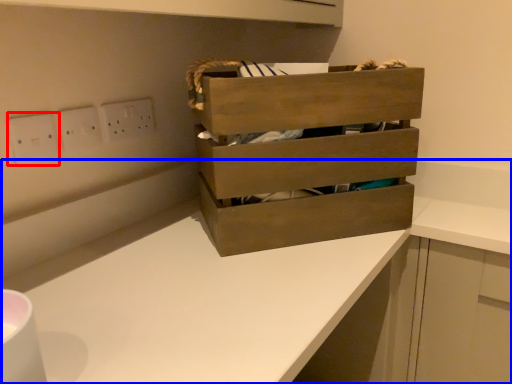
Question: Which of the following is the closest to the observer, electric outlet (highlighted by a red box) or counter (highlighted by a blue box)?

Choices:
 (A) electric outlet
 (B) counter

Answer: (B)